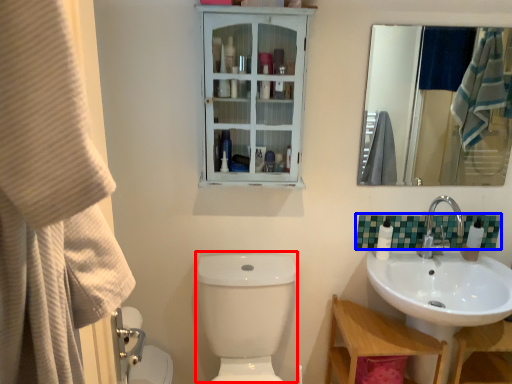
Question: Among these objects, which one is nearest to the camera, toilet bowl (highlighted by a red box) or tile (highlighted by a blue box)?

Choices:
 (A) toilet bowl
 (B) tile

Answer: (A)